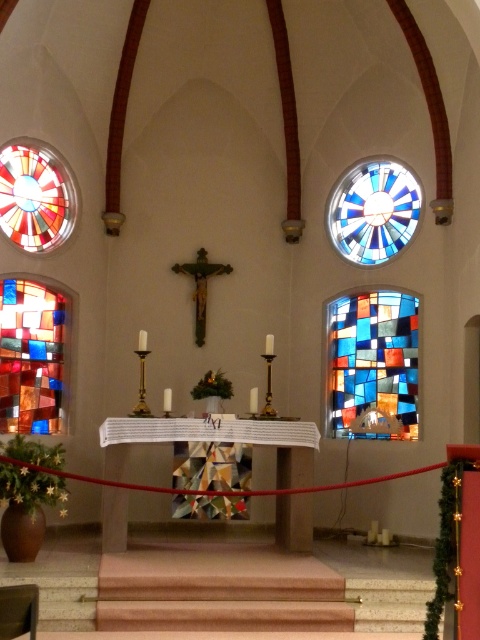
Question: Among these points, which one is farthest from the camera?

Choices:
 (A) (20, 216)
 (B) (403, 218)

Answer: (B)

Question: Which point appears farthest from the camera in this image?

Choices:
 (A) (52, 429)
 (B) (283, 440)

Answer: (A)

Question: Is stained glass window at right in front of geometric mosaic altar at center?

Choices:
 (A) no
 (B) yes

Answer: (A)

Question: Is stained glass window at right to the left of stained glass window at center from the viewer's perspective?

Choices:
 (A) yes
 (B) no

Answer: (B)

Question: Is geometric mosaic altar at center wider than stained glass window at center?

Choices:
 (A) no
 (B) yes

Answer: (B)

Question: Which of the following is the closest to the observer?

Choices:
 (A) stained glass window at center
 (B) geometric mosaic altar at center
 (C) stained glass window at upper right

Answer: (B)